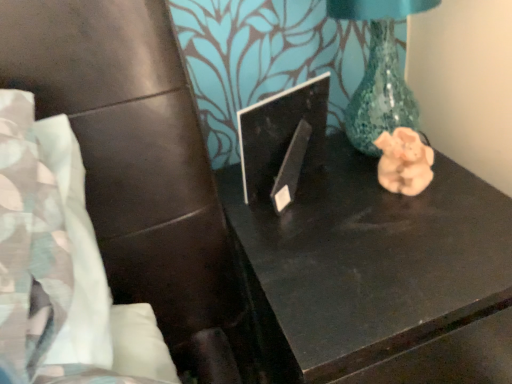
Question: Relative to black glossy table at center, is black glossy laptop at center in front or behind?

Choices:
 (A) front
 (B) behind

Answer: (B)

Question: Considering the relative positions of black glossy laptop at center and black glossy table at center in the image provided, is black glossy laptop at center to the left or to the right of black glossy table at center?

Choices:
 (A) left
 (B) right

Answer: (A)

Question: Which is farther from the pink clay pig at right?

Choices:
 (A) black glossy laptop at center
 (B) black glossy table at center

Answer: (A)

Question: Which object is positioned closest to the pink clay pig at right?

Choices:
 (A) black glossy laptop at center
 (B) black glossy table at center

Answer: (B)